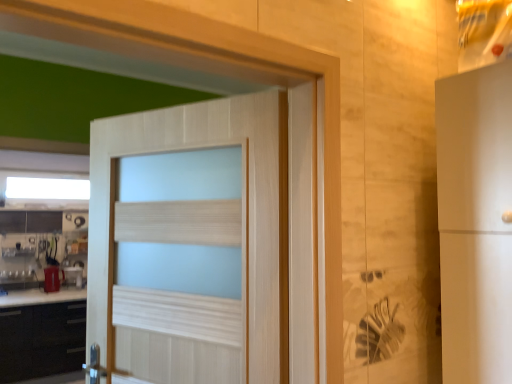
Question: From the image's perspective, is matte red cup at lower left, which ranks as the 2th appliance in front-to-back order, under white frosted glass window at upper center?

Choices:
 (A) no
 (B) yes

Answer: (B)

Question: Is matte red cup at lower left, which ranks as the 2th appliance in front-to-back order, facing towards white frosted glass window at upper center?

Choices:
 (A) yes
 (B) no

Answer: (B)

Question: Is matte red cup at lower left, which ranks as the 2th appliance in front-to-back order, shorter than white frosted glass window at upper center?

Choices:
 (A) yes
 (B) no

Answer: (A)

Question: Is the depth of matte red cup at lower left, which is counted as the first appliance, starting from the back, greater than that of white frosted glass window at upper center?

Choices:
 (A) no
 (B) yes

Answer: (B)

Question: Is matte red cup at lower left, which is counted as the first appliance, starting from the back, positioned in front of white frosted glass window at upper center?

Choices:
 (A) yes
 (B) no

Answer: (B)

Question: From a real-world perspective, is matte red cup at lower left, which ranks as the 2th appliance in front-to-back order, on white frosted glass window at upper center?

Choices:
 (A) yes
 (B) no

Answer: (B)

Question: From a real-world perspective, is metallic silver kettle at left, the first appliance from the front, positioned over light wood door at center based on gravity?

Choices:
 (A) yes
 (B) no

Answer: (B)

Question: From the image's perspective, is metallic silver kettle at left, which is the second appliance in back-to-front order, below light wood door at center?

Choices:
 (A) yes
 (B) no

Answer: (A)

Question: Does metallic silver kettle at left, which is the second appliance in back-to-front order, come behind light wood door at center?

Choices:
 (A) no
 (B) yes

Answer: (B)

Question: Can you confirm if metallic silver kettle at left, the first appliance from the front, is shorter than light wood door at center?

Choices:
 (A) yes
 (B) no

Answer: (A)

Question: Can you confirm if metallic silver kettle at left, the first appliance from the front, is wider than light wood door at center?

Choices:
 (A) no
 (B) yes

Answer: (B)

Question: From the image's perspective, is metallic silver kettle at left, the first appliance from the front, on light wood door at center?

Choices:
 (A) no
 (B) yes

Answer: (A)

Question: Considering the relative positions of metallic silver kettle at left, the first appliance from the front, and black matte cabinet at lower left in the image provided, is metallic silver kettle at left, the first appliance from the front, in front of black matte cabinet at lower left?

Choices:
 (A) no
 (B) yes

Answer: (A)